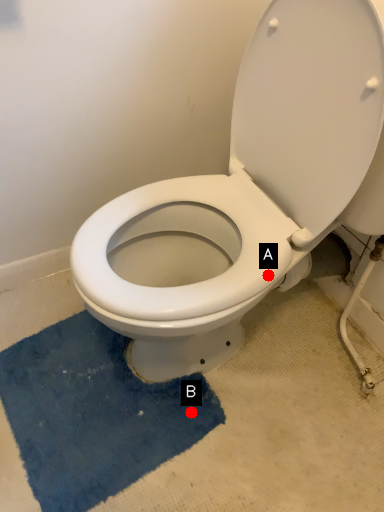
Question: Two points are circled on the image, labeled by A and B beside each circle. Which point appears farthest from the camera in this image?

Choices:
 (A) A is further
 (B) B is further

Answer: (B)